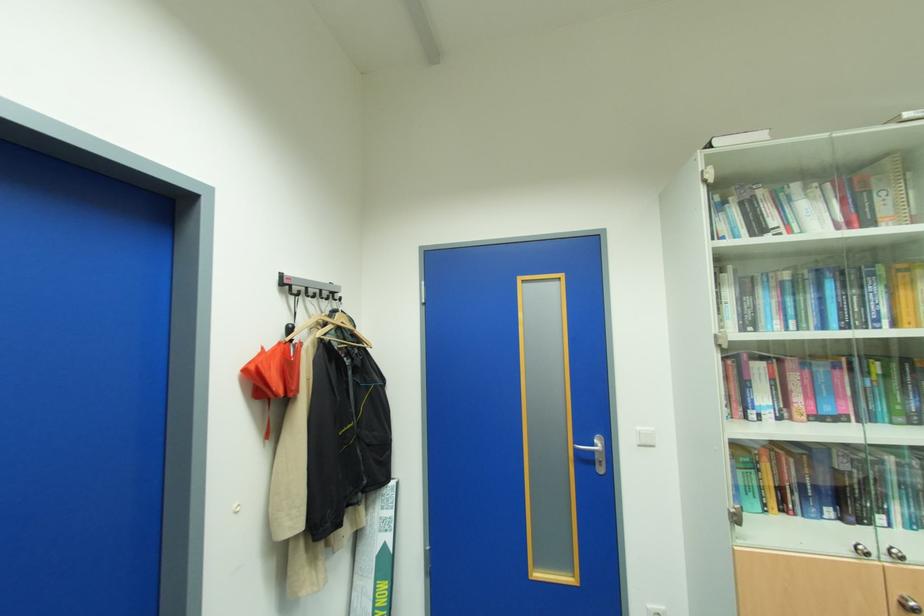
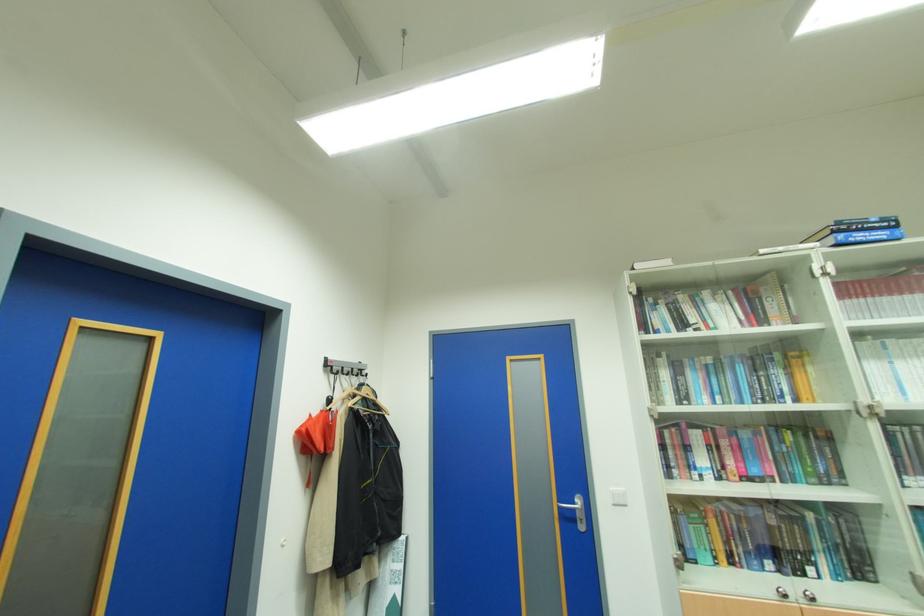
Question: The first image is from the beginning of the video and the second image is from the end. How did the camera likely rotate when shooting the video?

Choices:
 (A) Left
 (B) Right
 (C) Up
 (D) Down

Answer: (C)